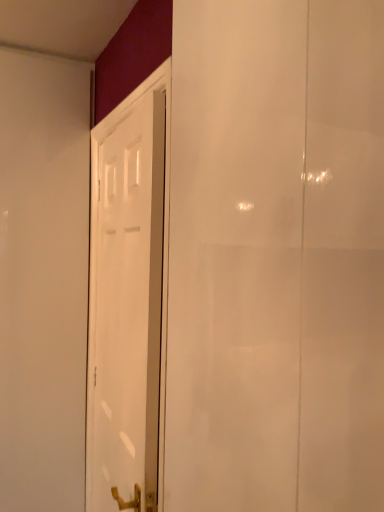
This screenshot has height=512, width=384. What do you see at coordinates (127, 308) in the screenshot?
I see `white glossy door at center` at bounding box center [127, 308].

Locate an element on the screen. The width and height of the screenshot is (384, 512). white glossy door at center is located at coordinates (127, 308).

This screenshot has height=512, width=384. Find the location of `transparent glass screen door at center`. transparent glass screen door at center is located at coordinates (276, 257).

What do you see at coordinates (276, 257) in the screenshot? I see `transparent glass screen door at center` at bounding box center [276, 257].

Find the location of a particular element. white glossy door at center is located at coordinates (127, 308).

Which is more to the left, white glossy door at center or transparent glass screen door at center?

Positioned to the left is white glossy door at center.

Is white glossy door at center in front of transparent glass screen door at center?

No, it is not.

Is point (97, 380) less distant than point (215, 377)?

No, it is behind (215, 377).

From the image's perspective, between white glossy door at center and transparent glass screen door at center, who is located below?

white glossy door at center, from the image's perspective.

From a real-world perspective, which object stands above the other?

From a 3D spatial view, transparent glass screen door at center is above.

Can you confirm if white glossy door at center is wider than transparent glass screen door at center?

Incorrect, the width of white glossy door at center does not surpass that of transparent glass screen door at center.

Considering the sizes of objects white glossy door at center and transparent glass screen door at center in the image provided, who is taller, white glossy door at center or transparent glass screen door at center?

With more height is white glossy door at center.

Based on the photo, based on their sizes in the image, would you say white glossy door at center is bigger or smaller than transparent glass screen door at center?

Considering their sizes, white glossy door at center takes up less space than transparent glass screen door at center.

Is white glossy door at center spatially inside transparent glass screen door at center, or outside of it?

white glossy door at center cannot be found inside transparent glass screen door at center.

Is white glossy door at center directly adjacent to transparent glass screen door at center?

There is a gap between white glossy door at center and transparent glass screen door at center.

Is transparent glass screen door at center at the back of white glossy door at center?

No, white glossy door at center's orientation is not away from transparent glass screen door at center.

Can you tell me how much white glossy door at center and transparent glass screen door at center differ in facing direction?

white glossy door at center and transparent glass screen door at center are facing 1.11 degrees away from each other.

Measure the distance between white glossy door at center and transparent glass screen door at center.

The distance of white glossy door at center from transparent glass screen door at center is 19.70 inches.

You are a GUI agent. You are given a task and a screenshot of the screen. Output one action in this format:
    pyautogui.click(x=<x>, y=<y>)
    Task: Click on the screen door above the white glossy door at center (from a real-world perspective)
    
    Given the screenshot: What is the action you would take?
    pyautogui.click(x=276, y=257)

Is transparent glass screen door at center at the right side of white glossy door at center?

Yes.

In the image, is transparent glass screen door at center positioned in front of or behind white glossy door at center?

transparent glass screen door at center is in front of white glossy door at center.

Which point is more distant from viewer, (272, 266) or (115, 397)?

The point (115, 397) is farther from the camera.

Looking at this image, from the image's perspective, which one is positioned lower, transparent glass screen door at center or white glossy door at center?

white glossy door at center.

From a real-world perspective, is transparent glass screen door at center on top of white glossy door at center?

Yes, from a real-world perspective, transparent glass screen door at center is above white glossy door at center.

Looking at this image, is transparent glass screen door at center wider or thinner than white glossy door at center?

Clearly, transparent glass screen door at center has more width compared to white glossy door at center.

Looking at this image, between transparent glass screen door at center and white glossy door at center, which one has more height?

white glossy door at center is taller.

Between transparent glass screen door at center and white glossy door at center, which one has smaller size?

white glossy door at center is smaller.

Would you say transparent glass screen door at center is inside or outside white glossy door at center?

transparent glass screen door at center cannot be found inside white glossy door at center.

Looking at this image, is the surface of transparent glass screen door at center in direct contact with white glossy door at center?

No, transparent glass screen door at center is not in contact with white glossy door at center.

Is transparent glass screen door at center positioned with its back to white glossy door at center?

No.

How different are the orientations of transparent glass screen door at center and white glossy door at center in degrees?

The angular difference between transparent glass screen door at center and white glossy door at center is 1.11 degrees.

Measure the distance from transparent glass screen door at center to white glossy door at center.

transparent glass screen door at center is 19.70 inches away from white glossy door at center.

Locate an element on the screen. The width and height of the screenshot is (384, 512). door located behind the transparent glass screen door at center is located at coordinates (127, 308).

At what (x,y) coordinates should I click in order to perform the action: click on screen door in front of the white glossy door at center. Please return your answer as a coordinate pair (x, y). Looking at the image, I should click on (276, 257).

At what (x,y) coordinates should I click in order to perform the action: click on door behind the transparent glass screen door at center. Please return your answer as a coordinate pair (x, y). This screenshot has height=512, width=384. Looking at the image, I should click on [x=127, y=308].